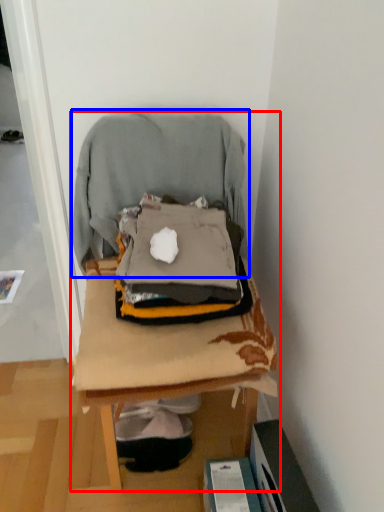
Question: Which object appears farthest to the camera in this image, furniture (highlighted by a red box) or bean bag chair (highlighted by a blue box)?

Choices:
 (A) furniture
 (B) bean bag chair

Answer: (B)